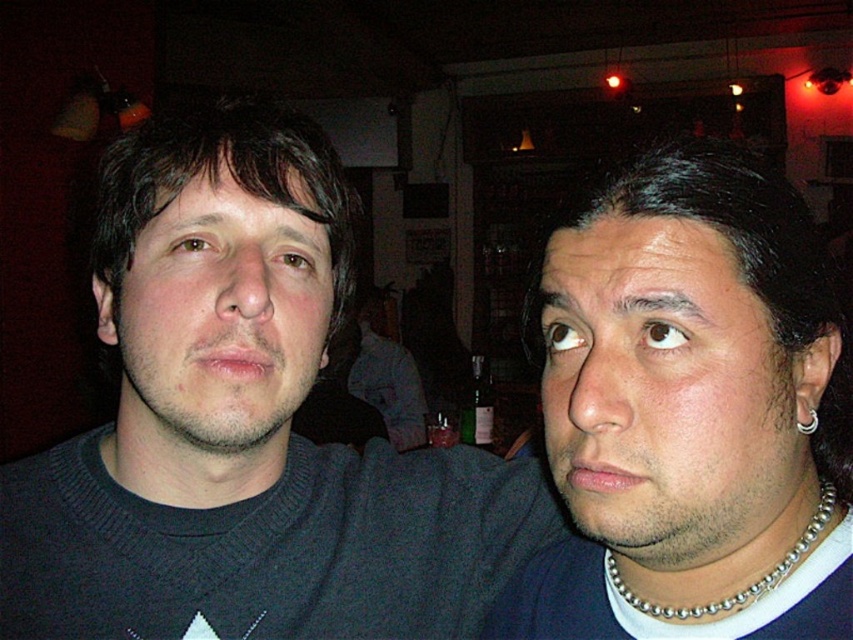
Question: Among these points, which one is nearest to the camera?

Choices:
 (A) pyautogui.click(x=254, y=401)
 (B) pyautogui.click(x=798, y=429)
 (C) pyautogui.click(x=821, y=497)

Answer: (B)

Question: Is dark gray sweater at center positioned behind smooth silver necklace at right?

Choices:
 (A) no
 (B) yes

Answer: (B)

Question: Among these points, which one is farthest from the camera?

Choices:
 (A) (802, 429)
 (B) (569, 230)

Answer: (A)

Question: Which object is farther from the camera taking this photo?

Choices:
 (A) silver metallic ring at right ear
 (B) smooth skin face at right

Answer: (A)

Question: Does smooth silver necklace at right have a smaller size compared to silver metallic ring at right ear?

Choices:
 (A) no
 (B) yes

Answer: (A)

Question: Does matte black face at left appear on the right side of silver metallic ring at right ear?

Choices:
 (A) yes
 (B) no

Answer: (B)